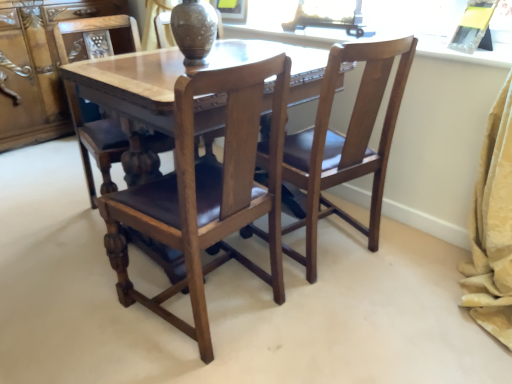
Where is `vacant area to the right of wooden chair at center, which appears as the third chair when viewed from the left`? This screenshot has height=384, width=512. vacant area to the right of wooden chair at center, which appears as the third chair when viewed from the left is located at coordinates (414, 252).